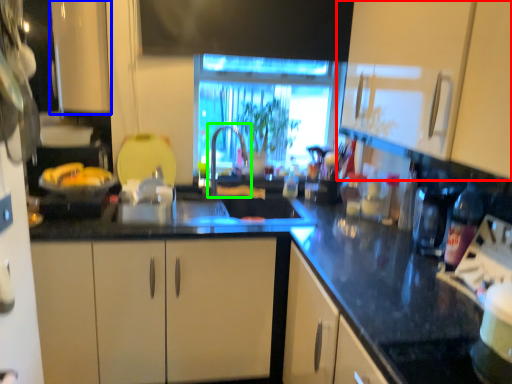
Question: Considering the real-world distances, which object is closest to cabinetry (highlighted by a red box)? cabinetry (highlighted by a blue box) or faucet (highlighted by a green box).

Choices:
 (A) cabinetry
 (B) faucet

Answer: (B)